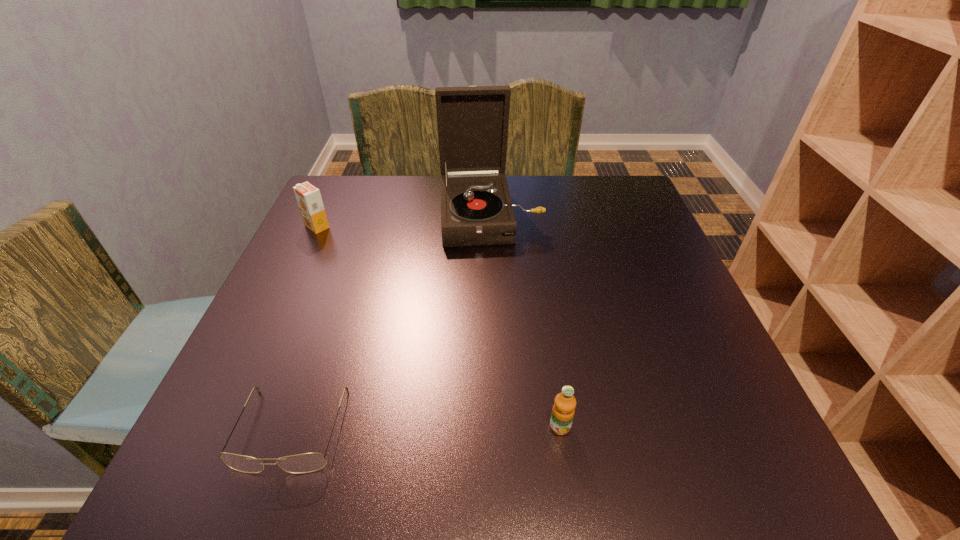
Locate an element on the screen. This screenshot has height=540, width=960. the tallest object is located at coordinates click(476, 209).

The width and height of the screenshot is (960, 540). I want to click on the farther orange juice, so click(309, 200).

Find the location of `the second tallest object`. the second tallest object is located at coordinates (309, 200).

Identify the location of the shorter orange juice. This screenshot has width=960, height=540. (563, 411).

This screenshot has width=960, height=540. Find the location of `the right orange juice`. the right orange juice is located at coordinates (563, 411).

At what (x,y) coordinates should I click in order to perform the action: click on the shortest object. Please return your answer as a coordinate pair (x, y). Looking at the image, I should click on (308, 462).

Where is `vacant position located on the left of the phonograph record`? The height and width of the screenshot is (540, 960). vacant position located on the left of the phonograph record is located at coordinates (383, 215).

In order to click on free space located 0.130m on the right of the farther orange juice in this screenshot , I will do `click(380, 227)`.

At what (x,y) coordinates should I click in order to perform the action: click on phonograph record situated at the far edge. Please return your answer as a coordinate pair (x, y). This screenshot has width=960, height=540. Looking at the image, I should click on (476, 209).

Locate an element on the screen. Image resolution: width=960 pixels, height=540 pixels. orange juice at the far edge is located at coordinates tap(309, 200).